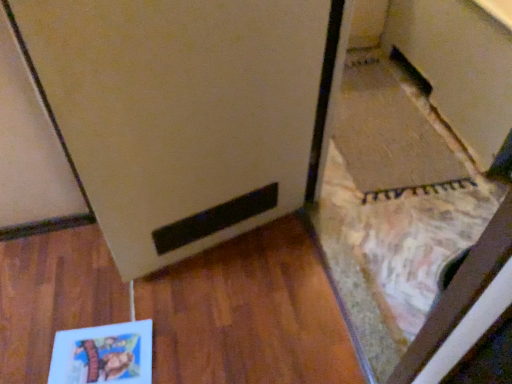
The width and height of the screenshot is (512, 384). In order to click on vacant space underneath matte paper book at lower left (from a real-world perspective) in this screenshot , I will do `click(103, 336)`.